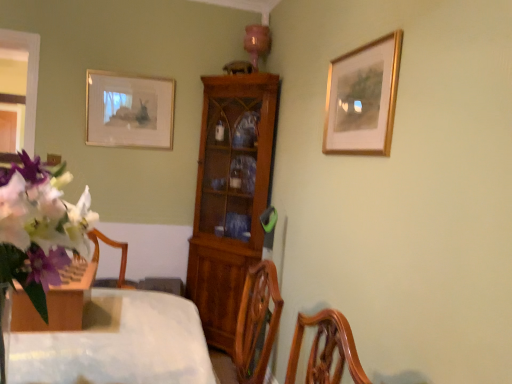
Question: Is wooden cabinet at center inside or outside of gold/golden picture frame at upper right, which ranks as the 1th picture frame in right-to-left order?

Choices:
 (A) inside
 (B) outside

Answer: (B)

Question: From the image's perspective, is wooden cabinet at center located above or below gold/golden picture frame at upper right, placed as the 2th picture frame when sorted from back to front?

Choices:
 (A) above
 (B) below

Answer: (B)

Question: Which of these objects is positioned closest to the matte white picture frame at upper left, the second picture frame in the right-to-left sequence?

Choices:
 (A) wooden cabinet at center
 (B) white matte flower at left
 (C) gold/golden picture frame at upper right, the 2th picture frame when ordered from left to right

Answer: (A)

Question: Based on their relative distances, which object is nearer to the white matte flower at left?

Choices:
 (A) gold/golden picture frame at upper right, which ranks as the 1th picture frame in right-to-left order
 (B) matte white picture frame at upper left, which appears as the 1th picture frame when viewed from the left
 (C) wooden cabinet at center

Answer: (A)